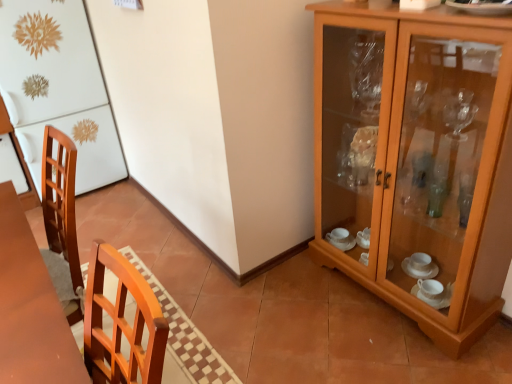
Question: Does point (496, 193) appear closer or farther from the camera than point (84, 29)?

Choices:
 (A) closer
 (B) farther

Answer: (A)

Question: Is wooden cabinet at right inside or outside of white glossy refrigerator at left?

Choices:
 (A) outside
 (B) inside

Answer: (A)

Question: Looking at the image, does wooden cabinet at right seem bigger or smaller compared to white glossy refrigerator at left?

Choices:
 (A) small
 (B) big

Answer: (A)

Question: Is white glossy refrigerator at left bigger or smaller than wooden cabinet at right?

Choices:
 (A) small
 (B) big

Answer: (B)

Question: Looking at their shapes, would you say white glossy refrigerator at left is wider or thinner than wooden cabinet at right?

Choices:
 (A) thin
 (B) wide

Answer: (B)

Question: From a real-world perspective, relative to wooden cabinet at right, is white glossy refrigerator at left vertically above or below?

Choices:
 (A) above
 (B) below

Answer: (A)

Question: From the image's perspective, is white glossy refrigerator at left above or below wooden cabinet at right?

Choices:
 (A) below
 (B) above

Answer: (B)